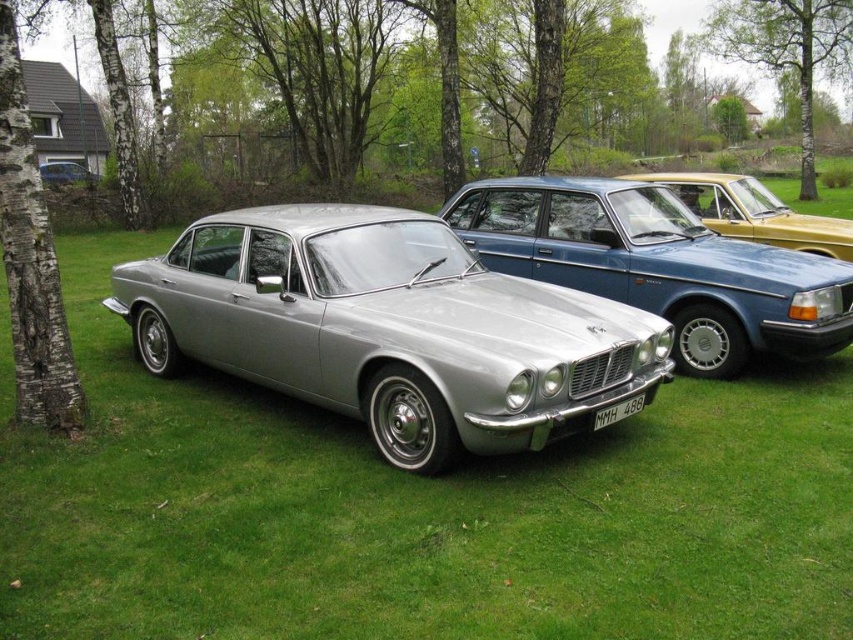
Can you confirm if metallic gold car at center is shorter than metallic silver car at left?

Correct, metallic gold car at center is not as tall as metallic silver car at left.

Is metallic gold car at center above metallic silver car at left?

Actually, metallic gold car at center is below metallic silver car at left.

Does point (744, 204) come farther from viewer compared to point (76, 179)?

No, (744, 204) is in front of (76, 179).

You are a GUI agent. You are given a task and a screenshot of the screen. Output one action in this format:
    pyautogui.click(x=<x>, y=<y>)
    Task: Click on the metallic gold car at center
    The width and height of the screenshot is (853, 640).
    Given the screenshot: What is the action you would take?
    pyautogui.click(x=753, y=212)

Between bark textured tree at left and metallic gold car at center, which one has more height?

With more height is bark textured tree at left.

In the scene shown: Does bark textured tree at left lie behind metallic gold car at center?

No, it is in front of metallic gold car at center.

The height and width of the screenshot is (640, 853). Find the location of `bark textured tree at left`. bark textured tree at left is located at coordinates (32, 260).

In the scene shown: Can you confirm if silver metallic car at center is shorter than metallic gold car at center?

No.

Looking at this image, is silver metallic car at center to the left of metallic gold car at center from the viewer's perspective?

Correct, you'll find silver metallic car at center to the left of metallic gold car at center.

Between point (517, 444) and point (753, 205), which one is positioned behind?

Positioned behind is point (753, 205).

At what (x,y) coordinates should I click in order to perform the action: click on silver metallic car at center. Please return your answer as a coordinate pair (x, y). Looking at the image, I should click on (387, 328).